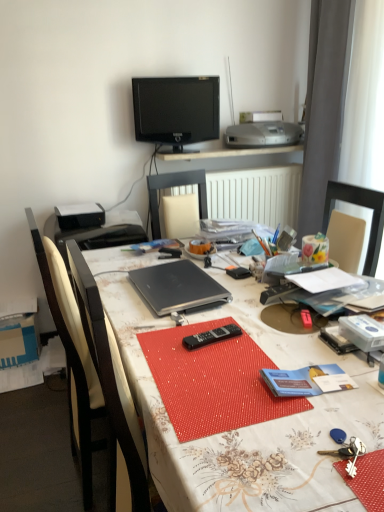
Locate an element on the screen. vacant area that is in front of black matte laptop at center is located at coordinates (184, 330).